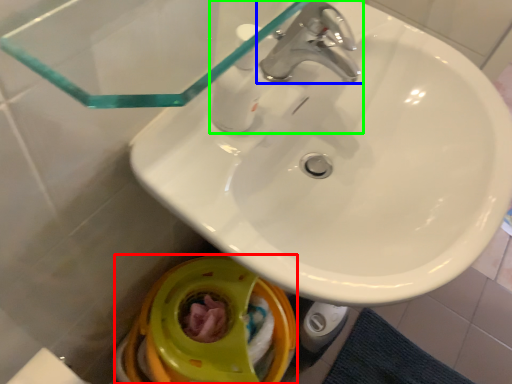
Question: Which object is positioned farthest from toilet bowl (highlighted by a red box)? Select from tap (highlighted by a blue box) and tap (highlighted by a green box).

Choices:
 (A) tap
 (B) tap

Answer: (A)